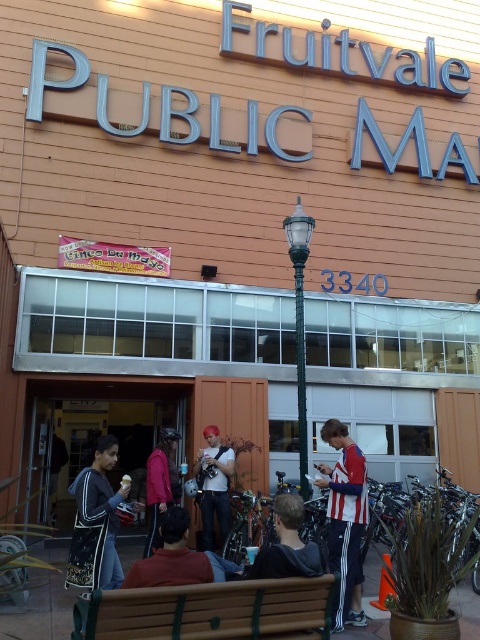
Can you confirm if black and white hoodie at lower left is positioned above green matte lamp post at center?

No, black and white hoodie at lower left is not above green matte lamp post at center.

Is black and white hoodie at lower left shorter than green matte lamp post at center?

Indeed, black and white hoodie at lower left has a lesser height compared to green matte lamp post at center.

This screenshot has height=640, width=480. What are the coordinates of `black and white hoodie at lower left` in the screenshot? It's located at (96, 522).

Does brown wooden bench at lower center come behind dark brown leather jacket at lower center?

No, brown wooden bench at lower center is in front of dark brown leather jacket at lower center.

Measure the distance between brown wooden bench at lower center and dark brown leather jacket at lower center.

They are 31.65 centimeters apart.

Is point (218, 605) positioned before point (202, 580)?

That is True.

This screenshot has height=640, width=480. Find the location of `brown wooden bench at lower center`. brown wooden bench at lower center is located at coordinates (210, 611).

Is point (124, 582) less distant than point (285, 536)?

Yes.

At what (x,y) coordinates should I click in order to perform the action: click on dark brown leather jacket at lower center. Please return your answer as a coordinate pair (x, y). This screenshot has width=480, height=640. Looking at the image, I should click on (170, 557).